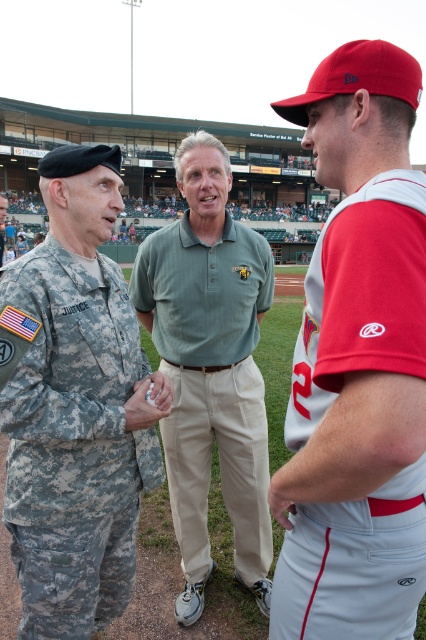
You are standing at the center of the baseball stadium field. You want to throw a baseball to the red fabric baseball cap at upper right. What are the coordinates of the point where you should aim?

The coordinates of the point where you should aim are at point (x=356, y=364).

You are a photographer at the baseball stadium and want to capture a photo that includes both the camouflage uniform at left and the green cotton polo shirt at center. Based on their positions, which subject should you focus on first to ensure both are in frame?

The camouflage uniform at left is positioned under the green cotton polo shirt at center, so you should focus on the green cotton polo shirt at center first to ensure both are in frame.

You are attending a baseball game and notice two items in the image. The first is the red fabric baseball cap at upper right, and the second is the green cotton polo shirt at center. Which item appears bigger in the image?

The red fabric baseball cap at upper right appears larger in size than the green cotton polo shirt at center.